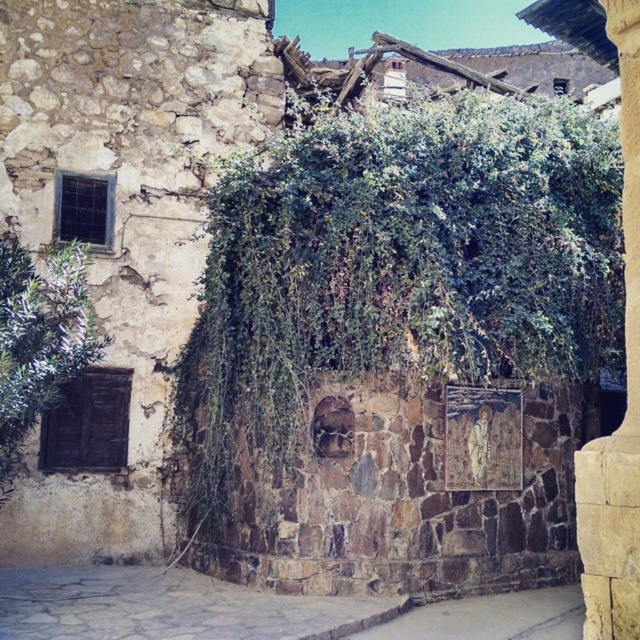
Question: Is gray stone alley at lower center positioned behind smooth stone pillar at right?

Choices:
 (A) yes
 (B) no

Answer: (A)

Question: Can you confirm if gray stone alley at lower center is bigger than smooth stone pillar at right?

Choices:
 (A) no
 (B) yes

Answer: (B)

Question: Which of the following is the farthest from the observer?

Choices:
 (A) gray stone alley at lower center
 (B) smooth stone pillar at right

Answer: (A)

Question: Which object is positioned farthest from the smooth stone pillar at right?

Choices:
 (A) green leafy ivy at center
 (B) gray stone alley at lower center

Answer: (B)

Question: Does green leafy ivy at center appear under smooth stone pillar at right?

Choices:
 (A) yes
 (B) no

Answer: (A)

Question: Among these objects, which one is farthest from the camera?

Choices:
 (A) green leafy ivy at center
 (B) gray stone alley at lower center

Answer: (A)